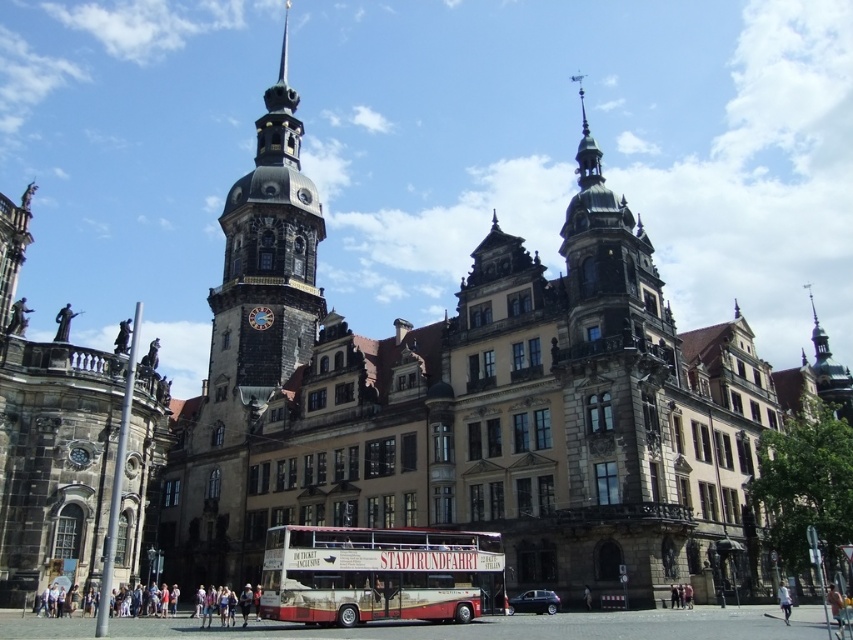
Question: Is dark gray stone tower at upper center smaller than red painted wood decker bus at center?

Choices:
 (A) yes
 (B) no

Answer: (B)

Question: Is dark gray stone tower at upper center further to camera compared to red painted wood decker bus at center?

Choices:
 (A) yes
 (B) no

Answer: (A)

Question: Which point appears farthest from the camera in this image?

Choices:
 (A) (263, 129)
 (B) (376, 611)

Answer: (A)

Question: Which object appears closest to the camera in this image?

Choices:
 (A) dark gray stone tower at upper center
 (B) red painted wood decker bus at center

Answer: (B)

Question: Is dark gray stone tower at upper center above red painted wood decker bus at center?

Choices:
 (A) no
 (B) yes

Answer: (B)